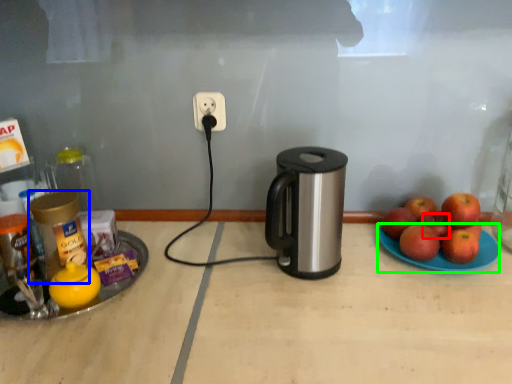
Question: Which object is positioned closest to apple (highlighted by a red box)? Select from bottle (highlighted by a blue box) and glass plate (highlighted by a green box).

Choices:
 (A) bottle
 (B) glass plate

Answer: (B)